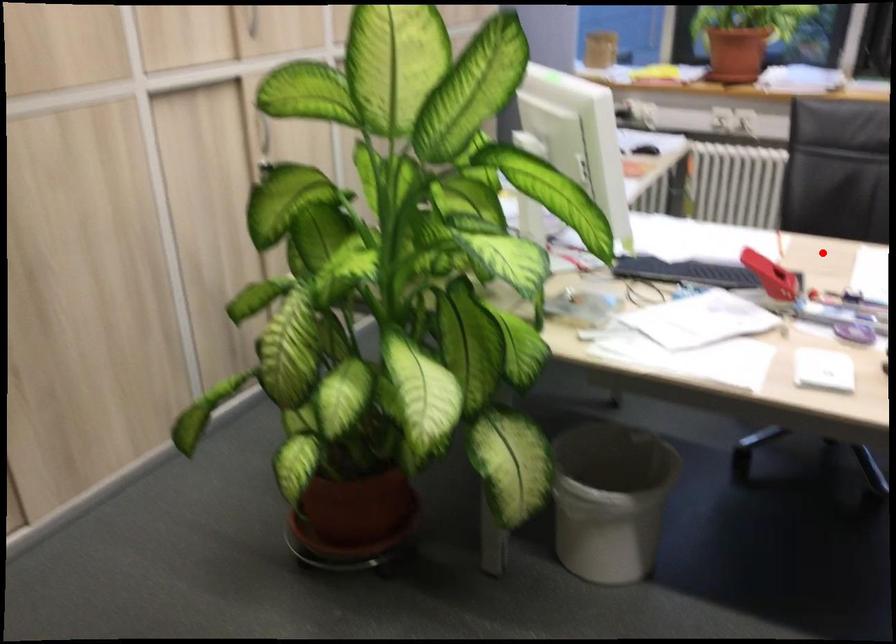
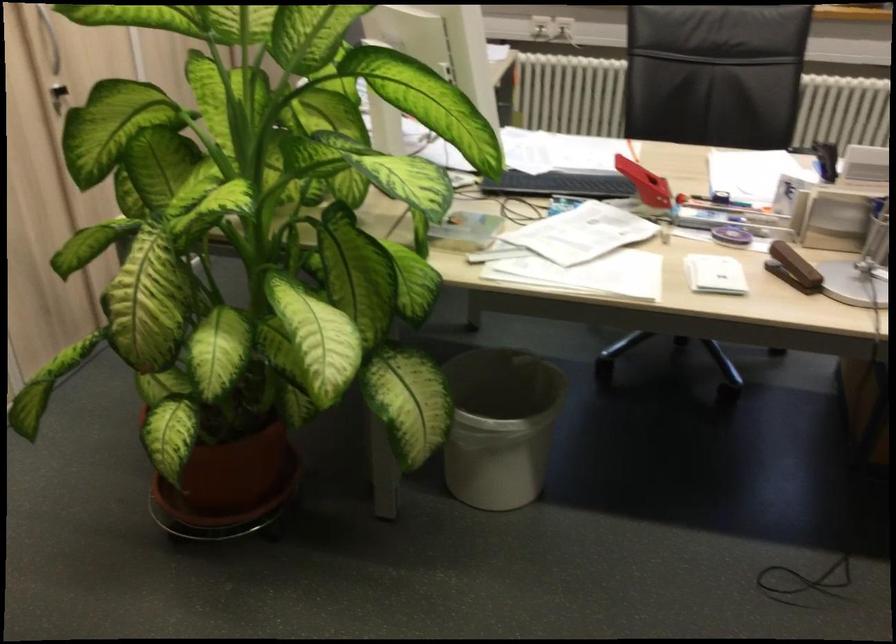
Find the pixel in the second image that matches the highlighted location in the first image.

(676, 158)